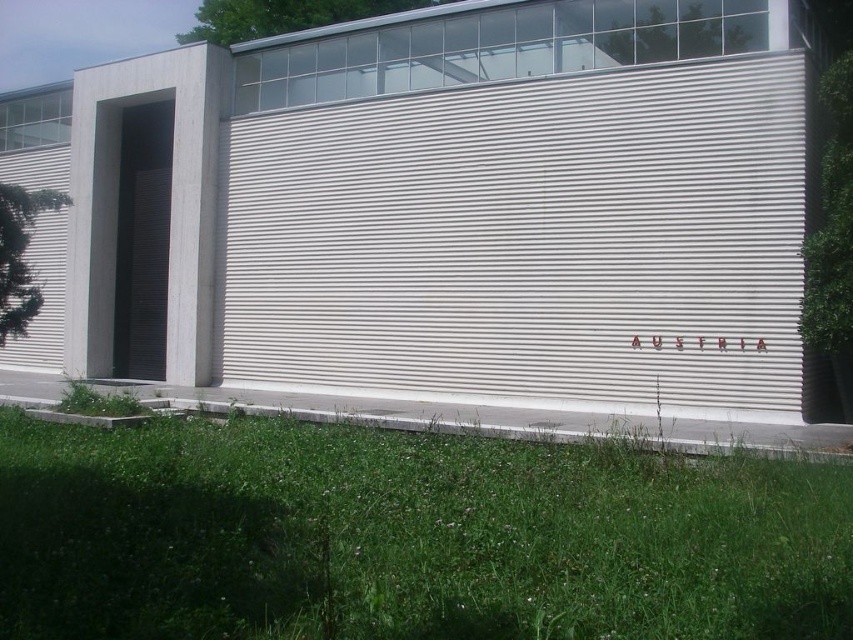
You are standing in front of a modern building with a large horizontal corrugated metal facade. There is a point marked at coordinates (526, 237). What is the name of the material at that point?

The point at coordinates (526, 237) corresponds to the white corrugated metal at center.

You are a maintenance worker who needs to reach the top of the white corrugated metal at center and the green grass at lower center. Which one will require a ladder to climb?

The white corrugated metal at center is much taller than the green grass at lower center, so you will need a ladder to reach its top, while the green grass at lower center does not require a ladder.

You are standing in front of the building and want to locate the white corrugated metal at center. According to the coordinates given, where would you look?

The white corrugated metal at center is located at coordinates point (x=526, y=237).